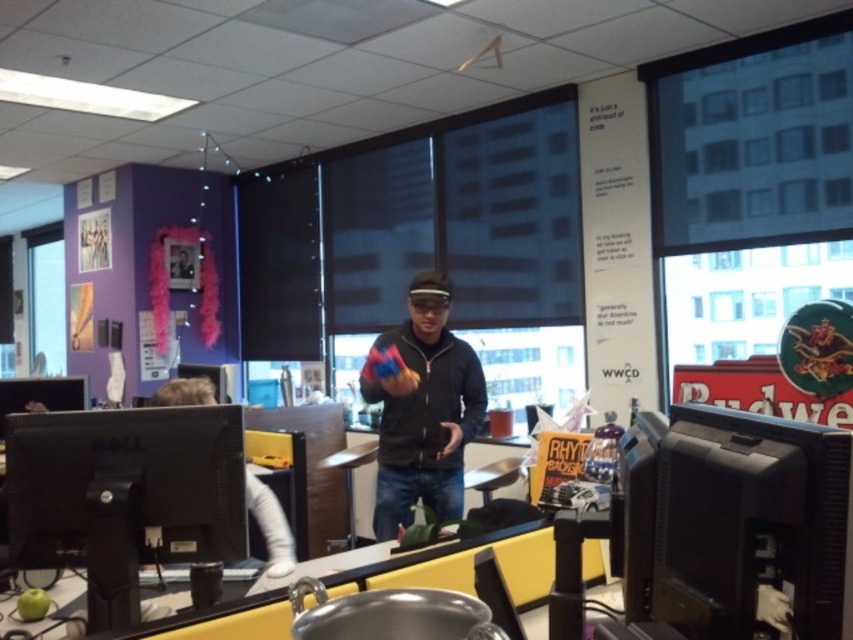
Question: Which object is farther from the camera taking this photo?

Choices:
 (A) black matte monitor at right
 (B) black matte monitor at left
 (C) black matte jacket at center
 (D) white matte monitor at left

Answer: (C)

Question: Is black matte monitor at right to the left of black matte jacket at center from the viewer's perspective?

Choices:
 (A) yes
 (B) no

Answer: (B)

Question: Which object is positioned farthest from the black matte monitor at right?

Choices:
 (A) white matte monitor at left
 (B) black matte monitor at left
 (C) black matte jacket at center

Answer: (C)

Question: Can you confirm if black matte monitor at right is bigger than white matte monitor at left?

Choices:
 (A) no
 (B) yes

Answer: (A)

Question: Which of the following is the farthest from the observer?

Choices:
 (A) (663, 561)
 (B) (178, 396)
 (C) (148, 490)
 (D) (393, 404)

Answer: (D)

Question: Does black matte monitor at right lie in front of white matte monitor at left?

Choices:
 (A) no
 (B) yes

Answer: (B)